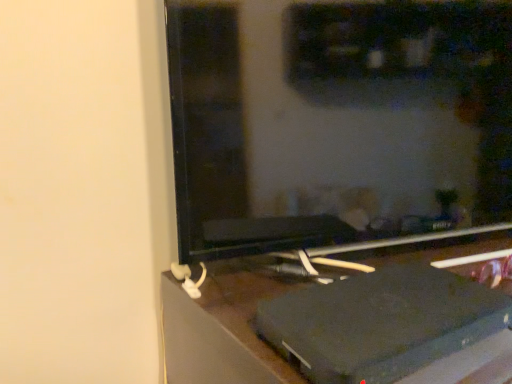
Question: From the image's perspective, is black matte computer monitor at center located above or below black plastic laptop at lower right?

Choices:
 (A) above
 (B) below

Answer: (A)

Question: From a real-world perspective, is black matte computer monitor at center above or below black plastic laptop at lower right?

Choices:
 (A) above
 (B) below

Answer: (A)

Question: From their relative heights in the image, would you say black matte computer monitor at center is taller or shorter than black plastic laptop at lower right?

Choices:
 (A) short
 (B) tall

Answer: (A)

Question: From the image's perspective, is black plastic laptop at lower right positioned above or below black matte computer monitor at center?

Choices:
 (A) below
 (B) above

Answer: (A)

Question: In terms of width, does black plastic laptop at lower right look wider or thinner when compared to black matte computer monitor at center?

Choices:
 (A) wide
 (B) thin

Answer: (A)

Question: From a real-world perspective, is black plastic laptop at lower right above or below black matte computer monitor at center?

Choices:
 (A) above
 (B) below

Answer: (B)

Question: Do you think black plastic laptop at lower right is within black matte computer monitor at center, or outside of it?

Choices:
 (A) inside
 (B) outside

Answer: (B)